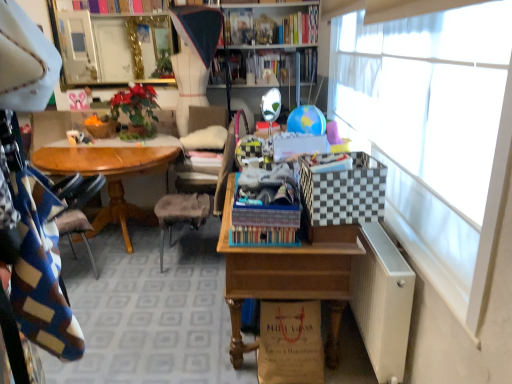
In order to click on free spot in front of brown fabric chair at center in this screenshot , I will do `click(140, 285)`.